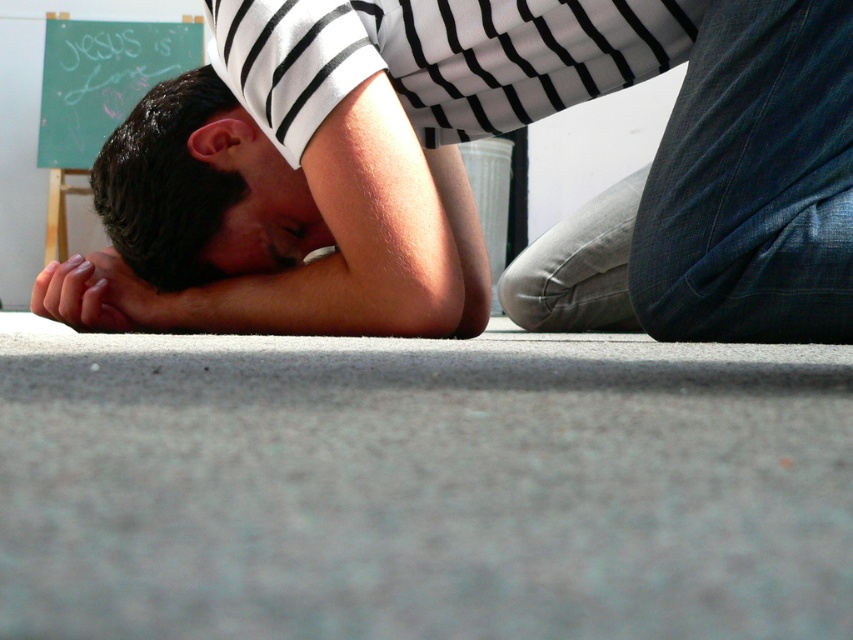
You are a photographer adjusting the camera focus. You need to ensure that both the matte black shirt at center and the smooth skin hand at lower left are in focus. Given their relative heights, which object should you focus on first to maximize the chances of both being sharp?

The matte black shirt at center has a greater height compared to the smooth skin hand at lower left. To maximize focus on both, you should focus on the matte black shirt at center first since it is taller and likely farther away, ensuring depth of field captures the closer hand as well.

What are the coordinates of the dark brown hair at center?

The dark brown hair at center is located at coordinates point [166,182].